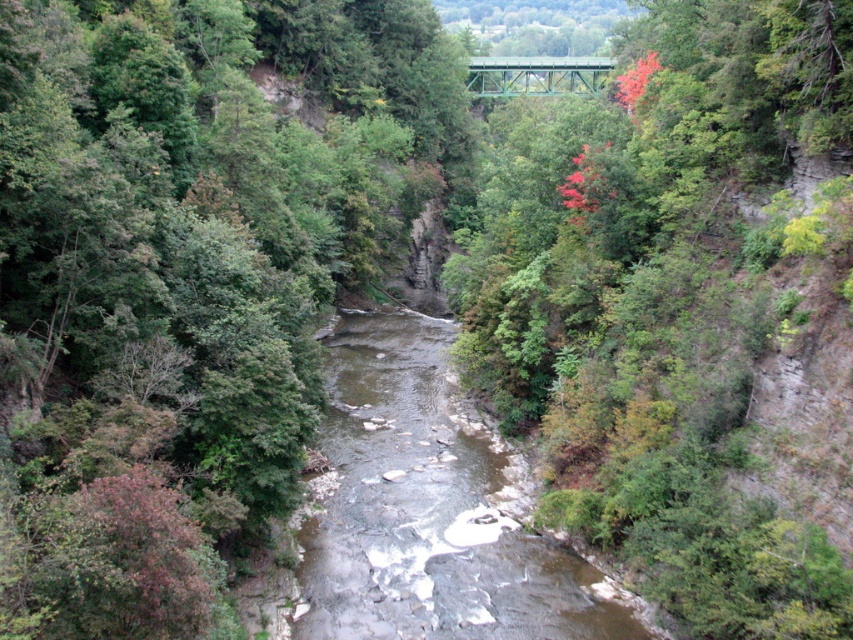
You are a hiker standing at the edge of the brown rocky stream at center and want to cross to the other side. The green metal bridge at upper center is nearby. Which direction should you walk to reach the bridge?

The brown rocky stream at center is in front of the green metal bridge at upper center, so you should walk towards the green metal bridge at upper center to cross the stream safely.

You are standing at the point with coordinates (x=428, y=508) in the image. What natural feature are you likely standing on?

You are likely standing on the brown rocky stream at center.